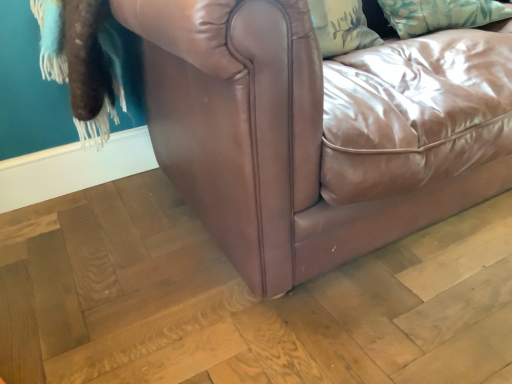
At what (x,y) coordinates should I click in order to perform the action: click on brown leather couch at center. Please return your answer as a coordinate pair (x, y). The height and width of the screenshot is (384, 512). Looking at the image, I should click on (293, 155).

This screenshot has height=384, width=512. What do you see at coordinates (293, 155) in the screenshot? I see `brown leather couch at center` at bounding box center [293, 155].

What are the coordinates of `brown leather couch at center` in the screenshot? It's located at (293, 155).